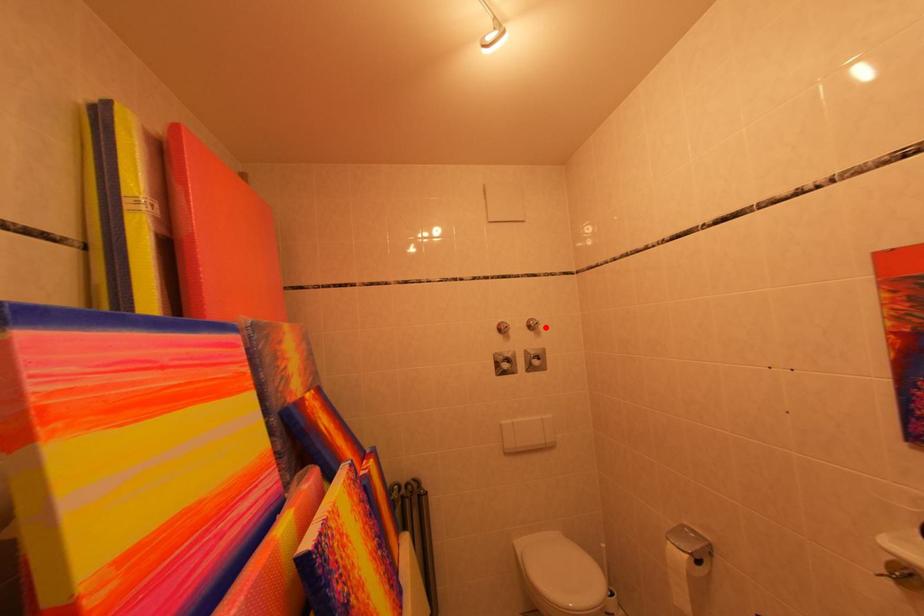
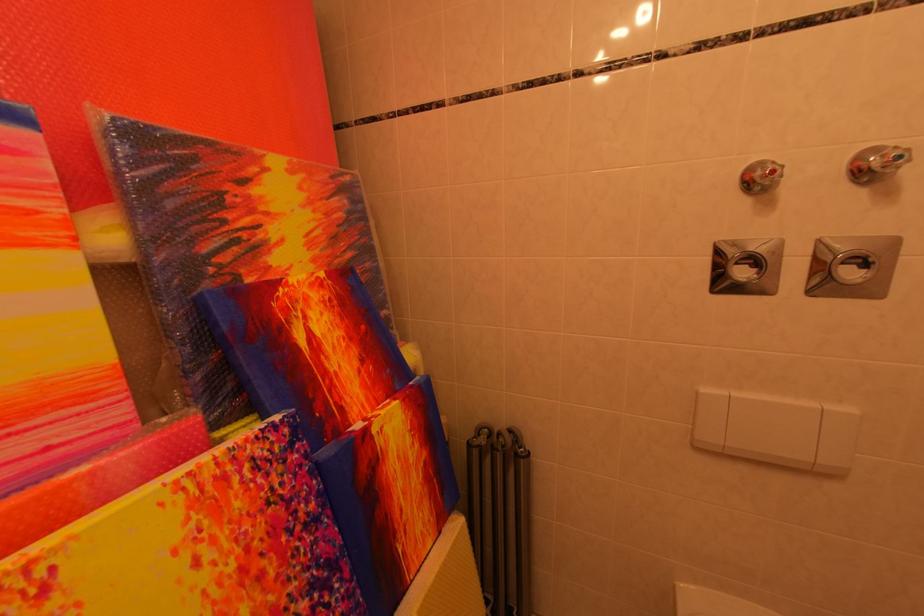
Question: I am providing you with two images of the same scene from different viewpoints. In image1, a red point is highlighted. Considering the same 3D point in image2, which of the following is correct?

Choices:
 (A) It is closer
 (B) It is farther

Answer: (B)